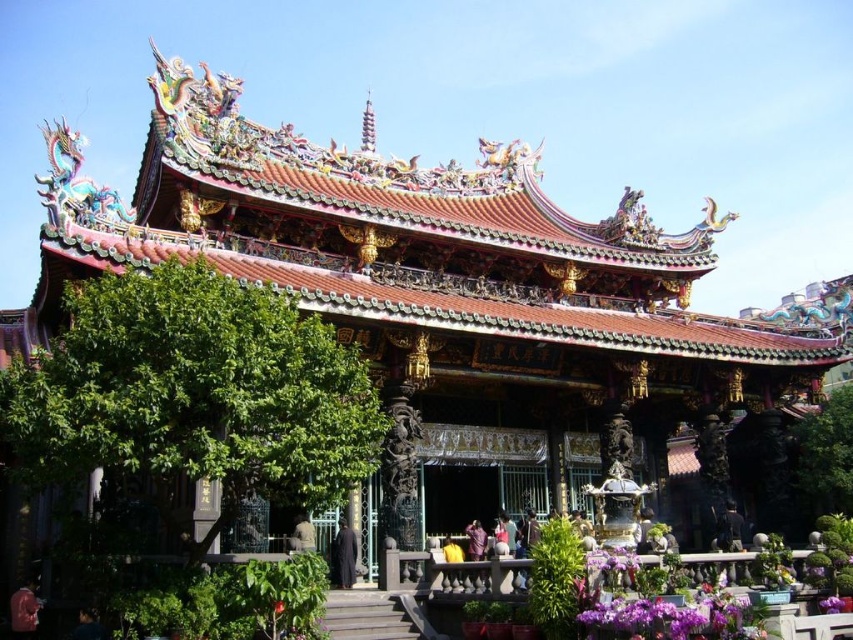
Between green leafy tree at left and green leafy tree at lower right, which one appears on the left side from the viewer's perspective?

green leafy tree at left

Who is positioned more to the right, green leafy tree at left or green leafy tree at lower right?

green leafy tree at lower right

I want to click on green leafy tree at left, so click(x=193, y=394).